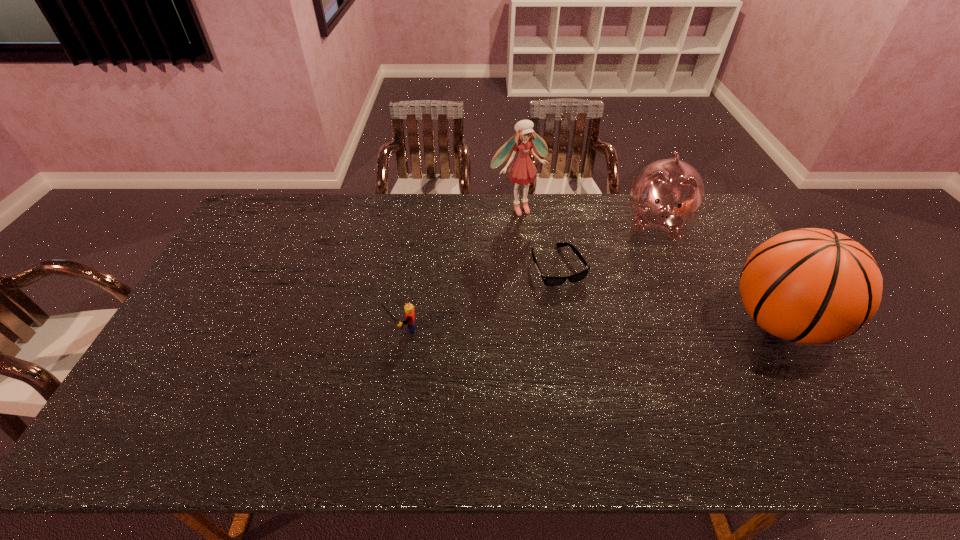
The width and height of the screenshot is (960, 540). I want to click on piggy bank that is at the far edge, so click(668, 194).

Where is `basketball that is at the right edge`? Image resolution: width=960 pixels, height=540 pixels. basketball that is at the right edge is located at coordinates (811, 286).

Find the location of a particular element. The image size is (960, 540). piggy bank that is at the right edge is located at coordinates (668, 194).

The height and width of the screenshot is (540, 960). I want to click on object that is at the far right corner, so click(x=668, y=194).

The height and width of the screenshot is (540, 960). In the image, there is a desktop. Identify the location of vacant space at the far edge. (615, 230).

In the image, there is a desktop. In order to click on vacant space at the near edge in this screenshot , I will do tap(503, 386).

Locate an element on the screen. The height and width of the screenshot is (540, 960). blank space at the left edge is located at coordinates tap(225, 269).

Identify the location of vacant space at the right edge of the desktop. This screenshot has width=960, height=540. (736, 261).

Identify the location of free space at the far left corner. This screenshot has height=540, width=960. (270, 196).

The image size is (960, 540). What are the coordinates of `free spot at the far right corner of the desktop` in the screenshot? It's located at coord(710,231).